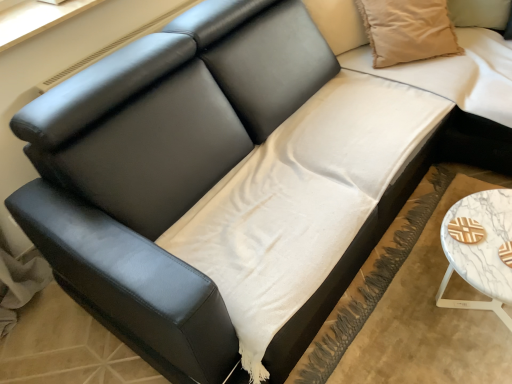
Describe the element at coordinates (407, 30) in the screenshot. This screenshot has height=384, width=512. I see `beige cotton pillow at upper right` at that location.

The height and width of the screenshot is (384, 512). Describe the element at coordinates (301, 201) in the screenshot. I see `white cotton sheet at center` at that location.

This screenshot has height=384, width=512. What are the coordinates of `beige cotton pillow at upper right` in the screenshot? It's located at (407, 30).

From a real-world perspective, is white marble table at lower right physically above white cotton sheet at center?

Yes, from a real-world perspective, white marble table at lower right is above white cotton sheet at center.

Which is behind, white marble table at lower right or white cotton sheet at center?

white marble table at lower right is further away from the camera.

Is point (474, 283) closer to camera compared to point (203, 243)?

Yes, it is in front of point (203, 243).

Which object is wider, white cotton sheet at center or beige cotton pillow at upper right?

Wider between the two is white cotton sheet at center.

From the image's perspective, which is below, white cotton sheet at center or beige cotton pillow at upper right?

From the image's view, white cotton sheet at center is below.

Who is more distant, white cotton sheet at center or beige cotton pillow at upper right?

beige cotton pillow at upper right is further away from the camera.

Between white cotton sheet at center and white marble table at lower right, which one has larger size?

white cotton sheet at center is bigger.

Does white cotton sheet at center have a greater width compared to white marble table at lower right?

Indeed, white cotton sheet at center has a greater width compared to white marble table at lower right.

Is white cotton sheet at center at the left side of white marble table at lower right?

Indeed, white cotton sheet at center is positioned on the left side of white marble table at lower right.

What are the coordinates of `sheet below the white marble table at lower right (from the image's perspective)` in the screenshot? It's located at (301, 201).

Are beige cotton pillow at upper right and white marble table at lower right far apart?

beige cotton pillow at upper right is actually quite close to white marble table at lower right.

Looking at this image, is beige cotton pillow at upper right completely or partially outside of white marble table at lower right?

beige cotton pillow at upper right lies outside white marble table at lower right's area.

Considering the sizes of objects beige cotton pillow at upper right and white marble table at lower right in the image provided, who is shorter, beige cotton pillow at upper right or white marble table at lower right?

white marble table at lower right.

This screenshot has height=384, width=512. I want to click on table that appears in front of the beige cotton pillow at upper right, so click(481, 252).

From the image's perspective, is white marble table at lower right over beige cotton pillow at upper right?

No.

Between white marble table at lower right and beige cotton pillow at upper right, which one has larger size?

Bigger between the two is white marble table at lower right.

Looking at their sizes, would you say white marble table at lower right is wider or thinner than beige cotton pillow at upper right?

In the image, white marble table at lower right appears to be wider than beige cotton pillow at upper right.

Is white marble table at lower right surrounding beige cotton pillow at upper right?

No.

Considering the relative positions of beige cotton pillow at upper right and white cotton sheet at center in the image provided, is beige cotton pillow at upper right to the left or to the right of white cotton sheet at center?

From the image, it's evident that beige cotton pillow at upper right is to the right of white cotton sheet at center.

Considering the relative sizes of beige cotton pillow at upper right and white cotton sheet at center in the image provided, is beige cotton pillow at upper right thinner than white cotton sheet at center?

Indeed, beige cotton pillow at upper right has a lesser width compared to white cotton sheet at center.

Measure the distance between beige cotton pillow at upper right and white cotton sheet at center.

A distance of 22.02 inches exists between beige cotton pillow at upper right and white cotton sheet at center.

From a real-world perspective, does beige cotton pillow at upper right sit lower than white cotton sheet at center?

No, from a real-world perspective, beige cotton pillow at upper right is not beneath white cotton sheet at center.

The image size is (512, 384). I want to click on table above the white cotton sheet at center (from the image's perspective), so click(x=481, y=252).

This screenshot has width=512, height=384. I want to click on sheet below the beige cotton pillow at upper right (from a real-world perspective), so click(x=301, y=201).

Looking at the image, which one is located closer to white marble table at lower right, beige cotton pillow at upper right or white cotton sheet at center?

white cotton sheet at center lies closer to white marble table at lower right than the other object.

Looking at this image, looking at the image, which one is located closer to white marble table at lower right, white cotton sheet at center or beige cotton pillow at upper right?

Based on the image, white cotton sheet at center appears to be nearer to white marble table at lower right.

Considering their positions, is white cotton sheet at center positioned closer to beige cotton pillow at upper right than white marble table at lower right?

Among the two, white cotton sheet at center is located nearer to beige cotton pillow at upper right.

Considering their positions, is beige cotton pillow at upper right positioned further to white cotton sheet at center than white marble table at lower right?

Based on the image, beige cotton pillow at upper right appears to be further to white cotton sheet at center.

When comparing their distances from beige cotton pillow at upper right, does white marble table at lower right or white cotton sheet at center seem closer?

white cotton sheet at center is closer to beige cotton pillow at upper right.

When comparing their distances from white cotton sheet at center, does white marble table at lower right or beige cotton pillow at upper right seem closer?

Based on the image, white marble table at lower right appears to be nearer to white cotton sheet at center.

Where is `table between beige cotton pillow at upper right and white cotton sheet at center from top to bottom`? table between beige cotton pillow at upper right and white cotton sheet at center from top to bottom is located at coordinates (481, 252).